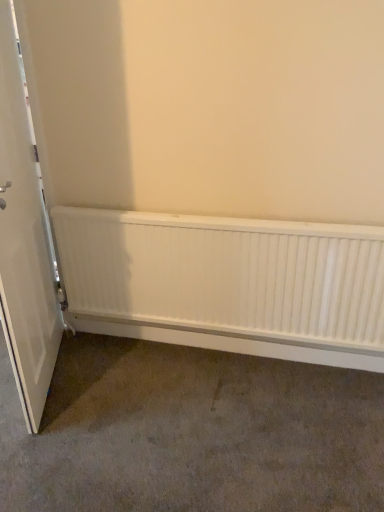
Question: In the image, is white matte door at left on the left side or the right side of white matte radiator at lower center?

Choices:
 (A) left
 (B) right

Answer: (A)

Question: Is white matte door at left inside the boundaries of white matte radiator at lower center, or outside?

Choices:
 (A) inside
 (B) outside

Answer: (B)

Question: Is point (6, 181) closer or farther from the camera than point (162, 321)?

Choices:
 (A) farther
 (B) closer

Answer: (B)

Question: In terms of size, does white matte radiator at lower center appear bigger or smaller than white matte door at left?

Choices:
 (A) small
 (B) big

Answer: (A)

Question: Is white matte radiator at lower center taller or shorter than white matte door at left?

Choices:
 (A) short
 (B) tall

Answer: (A)

Question: From a real-world perspective, relative to white matte door at left, is white matte radiator at lower center vertically above or below?

Choices:
 (A) below
 (B) above

Answer: (A)

Question: Is white matte radiator at lower center situated inside white matte door at left or outside?

Choices:
 (A) outside
 (B) inside

Answer: (A)